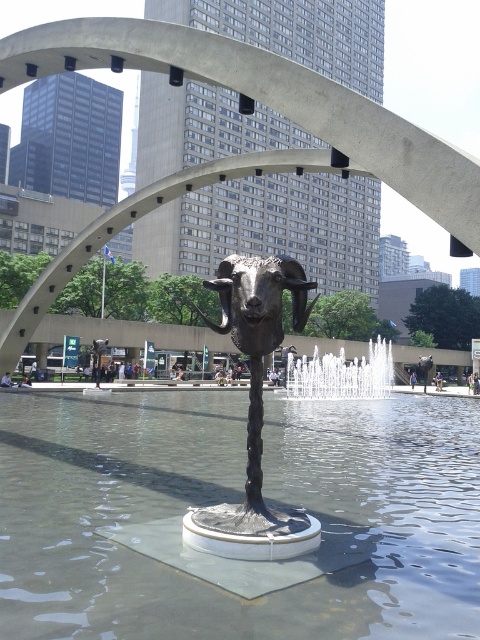
Question: Can you confirm if black polished metal ram at center is thinner than white frothy water at center?

Choices:
 (A) yes
 (B) no

Answer: (A)

Question: Does clear glass water at center appear under white frothy water at center?

Choices:
 (A) yes
 (B) no

Answer: (A)

Question: Estimate the real-world distances between objects in this image. Which object is farther from the clear glass water at center?

Choices:
 (A) white frothy water at center
 (B) polished bronze ram at center
 (C) black polished metal ram at center

Answer: (A)

Question: Which point is closer to the camera taking this photo?

Choices:
 (A) (276, 516)
 (B) (50, 620)

Answer: (B)

Question: Can you confirm if clear glass water at center is bigger than white frothy water at center?

Choices:
 (A) yes
 (B) no

Answer: (B)

Question: Estimate the real-world distances between objects in this image. Which object is farther from the black polished metal ram at center?

Choices:
 (A) clear glass water at center
 (B) polished bronze ram at center
 (C) white frothy water at center

Answer: (C)